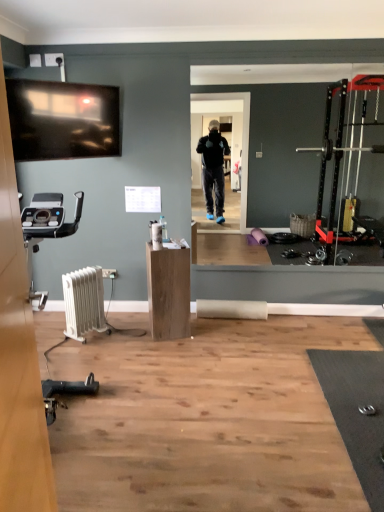
The height and width of the screenshot is (512, 384). Find the location of `free space to the left of wooden cabinet at center`. free space to the left of wooden cabinet at center is located at coordinates (131, 334).